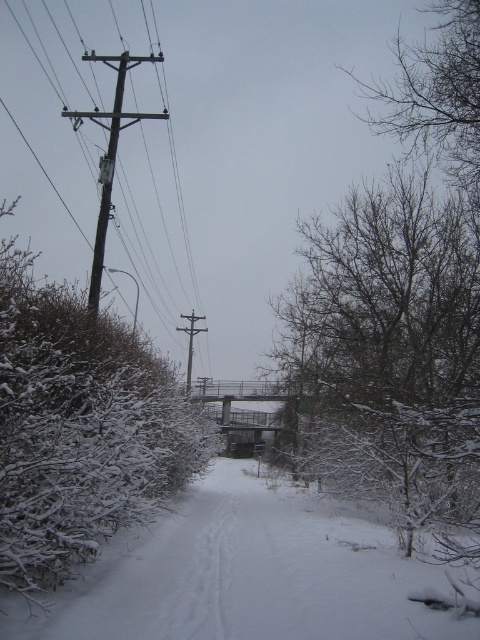
Can you confirm if bare branches at center is shorter than wooden utility pole at left?

Correct, bare branches at center is not as tall as wooden utility pole at left.

Does bare branches at center have a greater height compared to wooden utility pole at left?

No, bare branches at center is not taller than wooden utility pole at left.

This screenshot has height=640, width=480. What are the coordinates of `bare branches at center` in the screenshot? It's located at (391, 349).

From the picture: Can you confirm if white snow path at center is wider than wooden utility pole at left?

In fact, white snow path at center might be narrower than wooden utility pole at left.

Is point (311, 570) behind point (104, 180)?

No.

Where is `white snow path at center`? white snow path at center is located at coordinates (244, 573).

From the picture: Does bare branches at center have a greater height compared to white snow path at center?

Indeed, bare branches at center has a greater height compared to white snow path at center.

Is point (475, 349) closer to viewer compared to point (394, 561)?

No, (475, 349) is further to viewer.

Does point (434, 221) come in front of point (199, 612)?

No, (434, 221) is behind (199, 612).

This screenshot has width=480, height=640. In order to click on bare branches at center in this screenshot , I will do `click(391, 349)`.